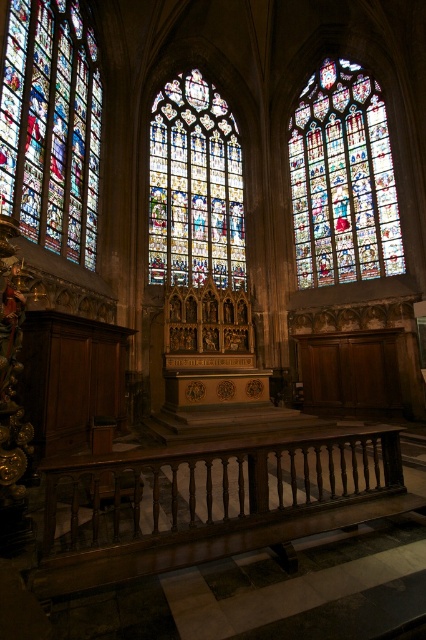
In the scene shown: You are standing in the cathedral and want to admire the stained glass window at left. To do so, you need to walk around the dark brown polished wood balustrade at lower center. Which direction should you move relative to the balustrade?

The dark brown polished wood balustrade at lower center is located below the stained glass window at left. To admire the stained glass window at left, you should move to the left side of the balustrade.

You are an architect examining the cathedral interior. You notice the stained glass window at upper right and the stained glass window at center. Which one has a greater height?

The stained glass window at upper right is taller than the stained glass window at center.

You are standing in the cathedral and want to take a photo of the dark brown polished wood balustrade at lower center and the stained glass window at left. Which object should you focus on first if you want to capture both in a single shot without moving the camera?

You should focus on the dark brown polished wood balustrade at lower center first because it is closer to the viewer than the stained glass window at left, allowing both to be in focus if the depth of field is sufficient.